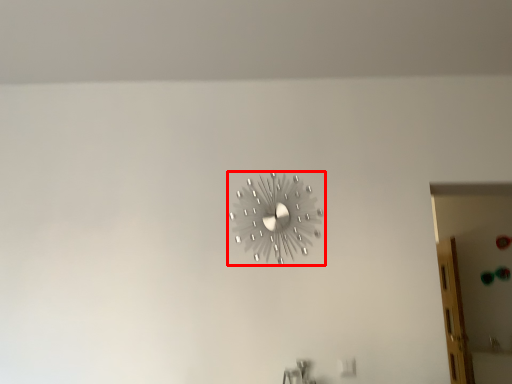
Question: Where is wall clock (annotated by the red box) located in relation to glass door in the image?

Choices:
 (A) left
 (B) right

Answer: (A)